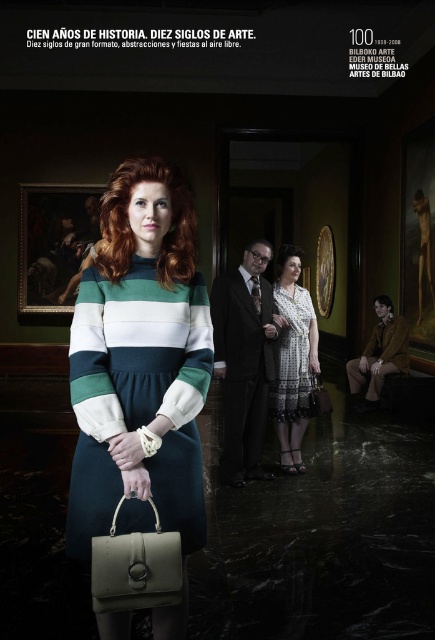
You are standing in the Bilbao Fine Arts Museum and want to take a photo of the matte black painting at upper left. You are currently 7.59 meters away from it. If your camera has a maximum focus range of 7 meters, will you be able to capture it clearly?

The distance between you and the matte black painting at upper left is exactly 7.59 meters. Since your camera can only focus up to 7 meters, you are 0.59 meters beyond the maximum range. To ensure a clear photo, move closer to reduce the distance below 7 meters.